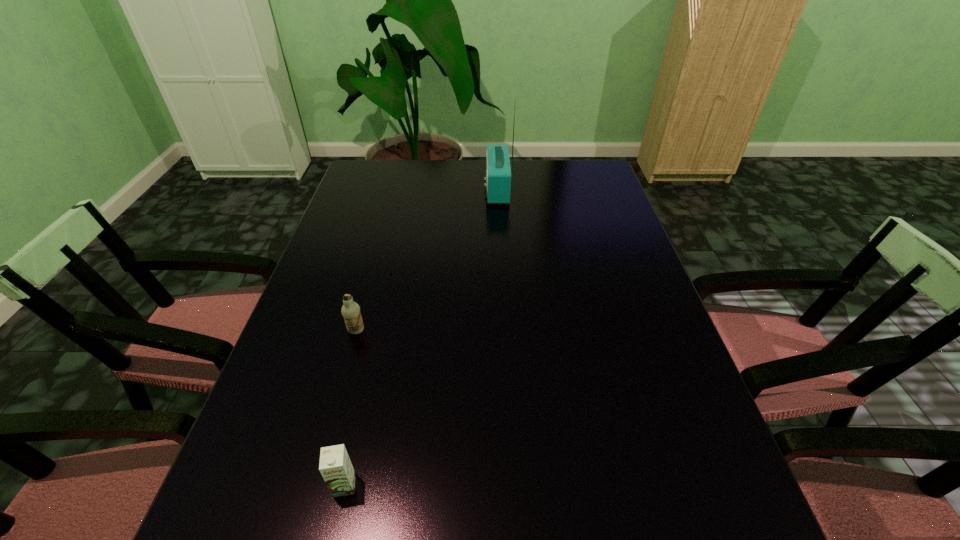
This screenshot has height=540, width=960. Identify the location of the farthest object. (498, 171).

The height and width of the screenshot is (540, 960). What are the coordinates of `the rightmost object` in the screenshot? It's located at (498, 171).

I want to click on the left chocolate milk, so click(x=350, y=310).

Locate an element on the screen. the leftmost object is located at coordinates (350, 310).

I want to click on the nearest object, so click(335, 466).

Where is `the right chocolate milk`? This screenshot has width=960, height=540. the right chocolate milk is located at coordinates (335, 466).

In order to click on vacant area located on the front panel of the rightmost object in this screenshot , I will do `click(428, 189)`.

Where is `free location located on the front panel of the rightmost object`? The width and height of the screenshot is (960, 540). free location located on the front panel of the rightmost object is located at coordinates (446, 189).

You are a GUI agent. You are given a task and a screenshot of the screen. Output one action in this format:
    pyautogui.click(x=<x>, y=<y>)
    Task: Click on the free space located 0.200m on the front panel of the rightmost object
    
    Given the screenshot: What is the action you would take?
    pyautogui.click(x=425, y=189)

Where is `vacant space located 0.250m on the right of the second nearest object`? This screenshot has height=540, width=960. vacant space located 0.250m on the right of the second nearest object is located at coordinates (472, 331).